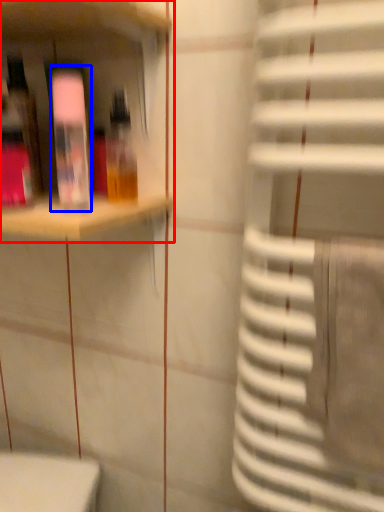
Question: Which object appears farthest to the camera in this image, shelf (highlighted by a red box) or bottle (highlighted by a blue box)?

Choices:
 (A) shelf
 (B) bottle

Answer: (B)